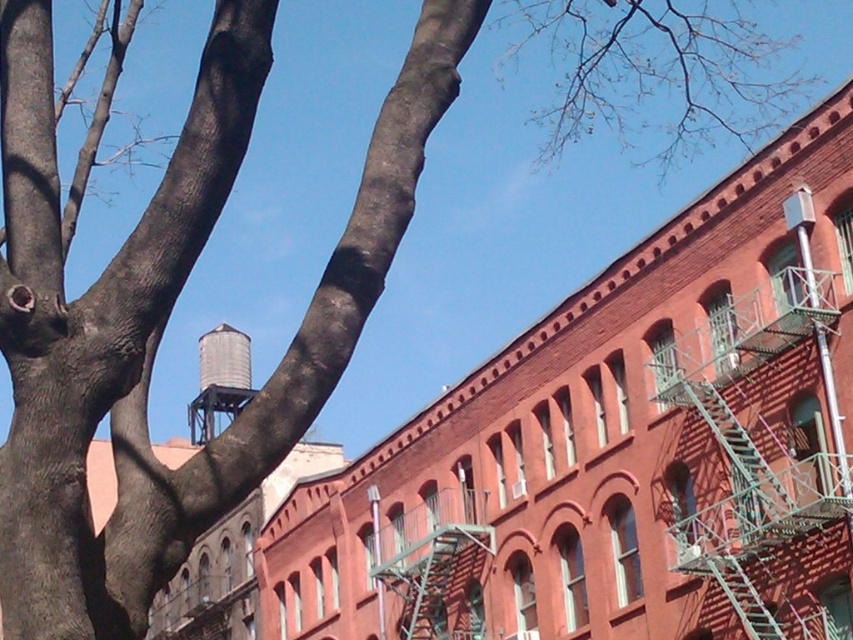
Is point (764, 330) behind point (393, 536)?

That is False.

Who is taller, metallic silver fire escape at right or green metal fire escape at center?

metallic silver fire escape at right is taller.

Where is `metallic silver fire escape at right`? This screenshot has height=640, width=853. metallic silver fire escape at right is located at coordinates coord(758,452).

Who is more forward, (433, 609) or (222, 388)?

Point (433, 609)

Can you confirm if green metal fire escape at center is taller than metallic silver water tower at center left?

No, green metal fire escape at center is not taller than metallic silver water tower at center left.

You are a GUI agent. You are given a task and a screenshot of the screen. Output one action in this format:
    pyautogui.click(x=<x>, y=<y>)
    Task: Click on the green metal fire escape at center
    The width and height of the screenshot is (853, 640).
    Given the screenshot: What is the action you would take?
    pyautogui.click(x=428, y=556)

Who is positioned more to the right, metallic silver fire escape at right or metallic silver water tower at center left?

metallic silver fire escape at right

Between metallic silver fire escape at right and metallic silver water tower at center left, which one is positioned lower?

metallic silver water tower at center left is lower down.

The height and width of the screenshot is (640, 853). In order to click on metallic silver fire escape at right in this screenshot , I will do `click(758, 452)`.